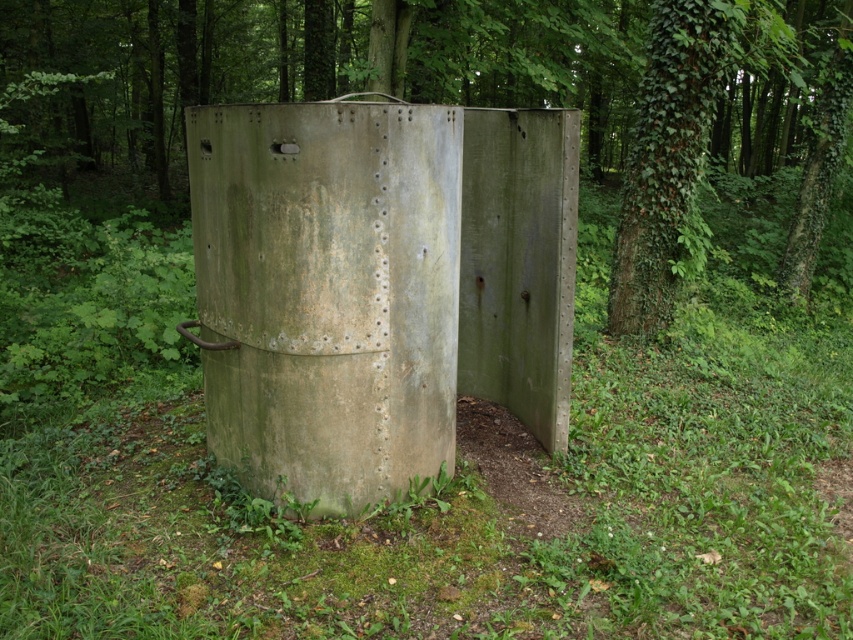
Can you confirm if green matte bunker at center is smaller than green ivy-covered tree at upper right?

Correct, green matte bunker at center occupies less space than green ivy-covered tree at upper right.

Measure the distance between green matte bunker at center and camera.

3.09 meters

Image resolution: width=853 pixels, height=640 pixels. Describe the element at coordinates (378, 284) in the screenshot. I see `green matte bunker at center` at that location.

Locate an element on the screen. This screenshot has width=853, height=640. green matte bunker at center is located at coordinates (378, 284).